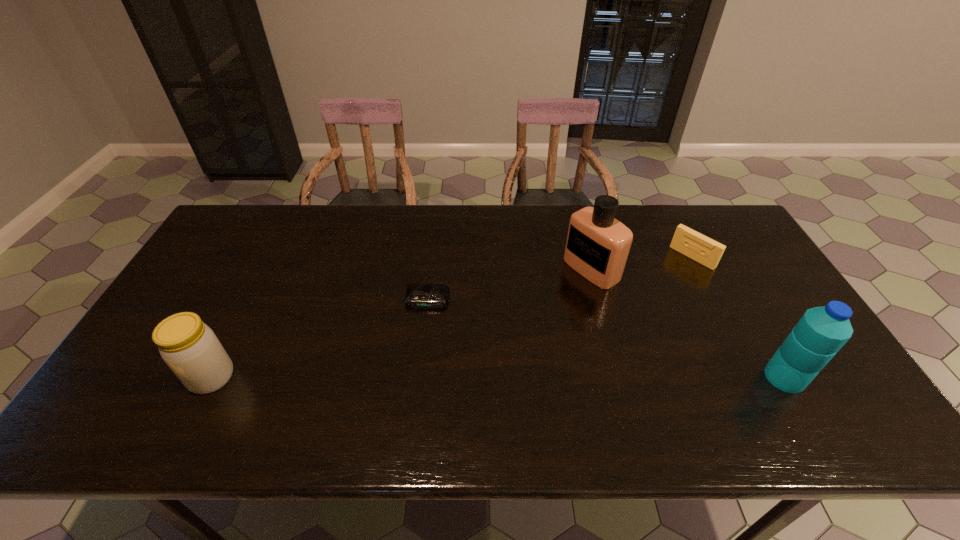
I want to click on the third tallest object, so click(x=190, y=348).

This screenshot has height=540, width=960. What are the coordinates of `jar` in the screenshot? It's located at (190, 348).

At what (x,y) coordinates should I click in order to perform the action: click on water bottle. Please return your answer as a coordinate pair (x, y). The image size is (960, 540). Looking at the image, I should click on (821, 332).

Locate an element on the screen. the third nearest object is located at coordinates (418, 295).

Find the location of a particular element. alarm clock is located at coordinates (418, 295).

This screenshot has height=540, width=960. I want to click on the third object from right to left, so click(x=597, y=247).

The image size is (960, 540). I want to click on the fourth tallest object, so (x=706, y=251).

Locate an element on the screen. The width and height of the screenshot is (960, 540). free region located on the right of the third shortest object is located at coordinates (275, 377).

Where is `blank area located on the left of the water bottle`? This screenshot has width=960, height=540. blank area located on the left of the water bottle is located at coordinates (717, 377).

Where is `vacant region located on the display of the third farthest object`? This screenshot has width=960, height=540. vacant region located on the display of the third farthest object is located at coordinates (412, 392).